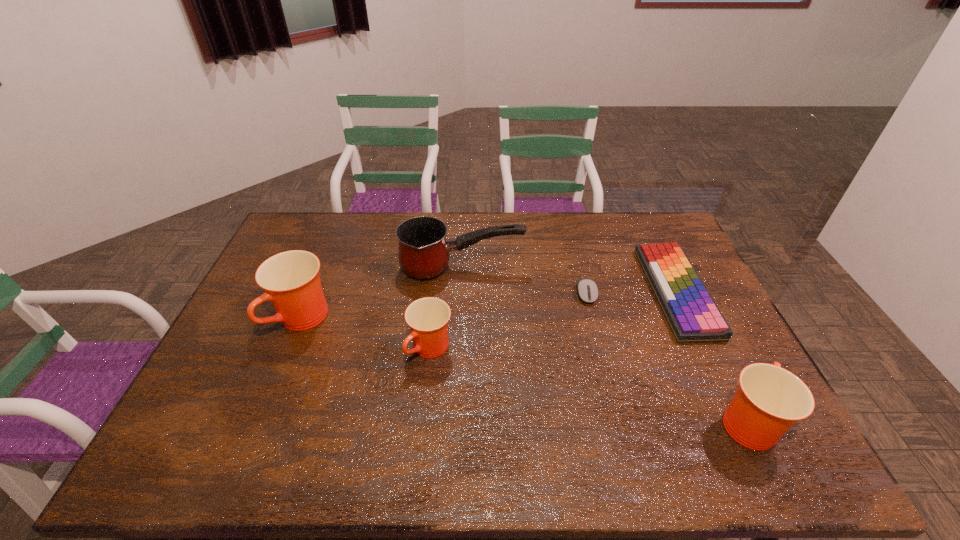
If equal spacing is desired by inserting an extra cup among them, please point out a free spot for this new cup. Please provide its 2D coordinates. Your answer should be formatted as a tuple, i.e. [(x, y)], where the tuple contains the x and y coordinates of a point satisfying the conditions above.

[(577, 383)]